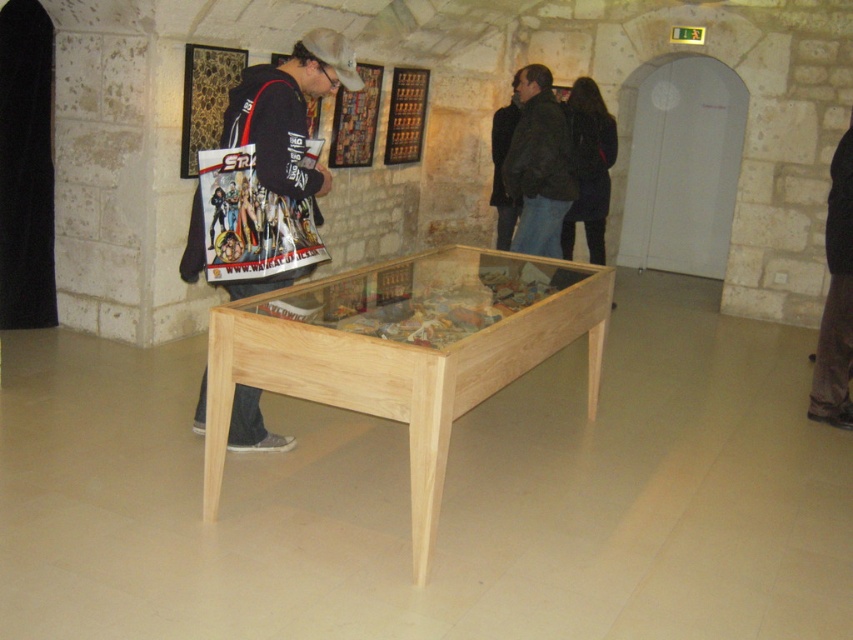
Question: Which of these objects is positioned closest to the natural wood table at center?

Choices:
 (A) brown fabric pants at right
 (B) matte black jacket at center
 (C) dark green jacket at center

Answer: (B)

Question: Does natural wood table at center come in front of brown fabric pants at right?

Choices:
 (A) no
 (B) yes

Answer: (B)

Question: Considering the relative positions of natural wood table at center and brown fabric pants at right in the image provided, where is natural wood table at center located with respect to brown fabric pants at right?

Choices:
 (A) below
 (B) above

Answer: (A)

Question: Which point is closer to the camera taking this photo?

Choices:
 (A) (347, 292)
 (B) (537, 180)
 (C) (838, 256)
 (D) (325, 70)

Answer: (A)

Question: Which point is farther from the camera taking this photo?

Choices:
 (A) (511, 177)
 (B) (209, 508)
 (C) (836, 160)
 (D) (242, 292)

Answer: (A)

Question: Is natural wood table at center below dark green jacket at center?

Choices:
 (A) no
 (B) yes

Answer: (B)